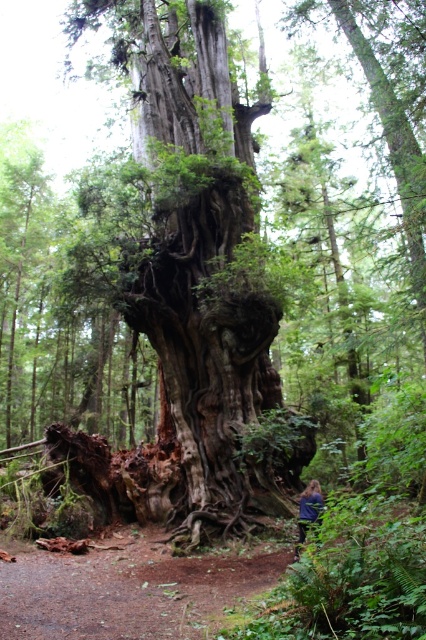
You are standing in the dense forest and see the rough bark tree trunk at center. Can you tell me the exact coordinates where you can find it?

The rough bark tree trunk at center is located at coordinates point (206, 282).

You are standing in a dense forest with a massive ancient tree. You notice a point marked at coordinates (x=206, y=282). What is located at that point?

The point at (x=206, y=282) is where the rough bark tree trunk at center is located.